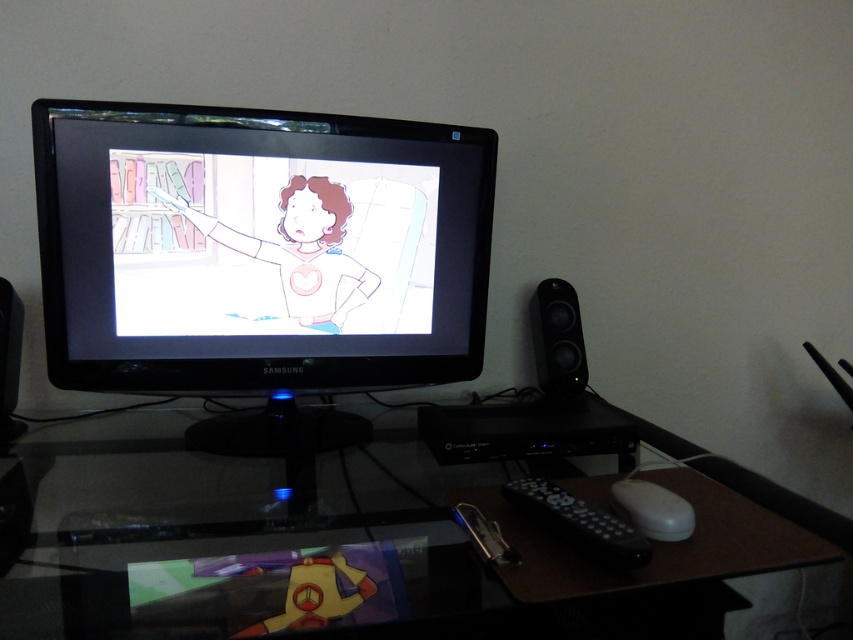
You are sitting on the couch and want to use either the black plastic remote at lower center or the white plastic mouse at lower right to control the entertainment system. Which device is easier to reach without moving your position?

The black plastic remote at lower center is closer to the viewer than the white plastic mouse at lower right, so it is easier to reach without moving your position.

You are organizing your home office and need to place a new 15 cm tall plant on the transparent glass computer desk at center. Considering the height of the black plastic speaker at right, will the plant be visible from above the desk?

The transparent glass computer desk at center is much taller than the black plastic speaker at right, so placing a 15 cm tall plant on the desk would make it visible from above since the desk itself is elevated higher than the speaker.

You are setting up a new entertainment system and need to place both the black plastic remote at lower center and the white plastic mouse at lower right on a shelf. The shelf has a width of 12 inches. If the remote is 4 inches wide and the mouse is 3 inches wide, will both items fit side by side on the shelf?

The black plastic remote at lower center is wider than the white plastic mouse at lower right. Since the total width of both items is 7 inches, which is less than the 12 inch shelf width, both items will fit side by side on the shelf.